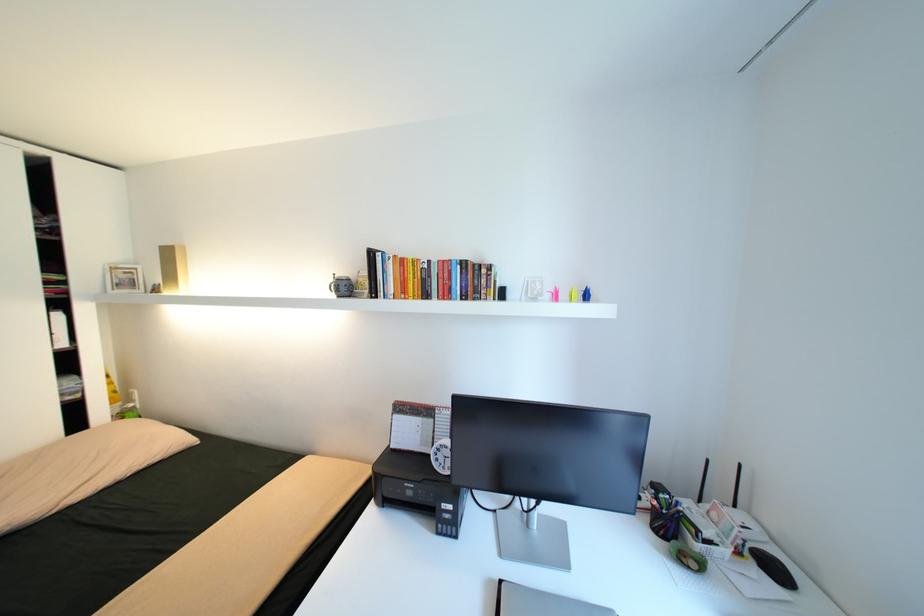
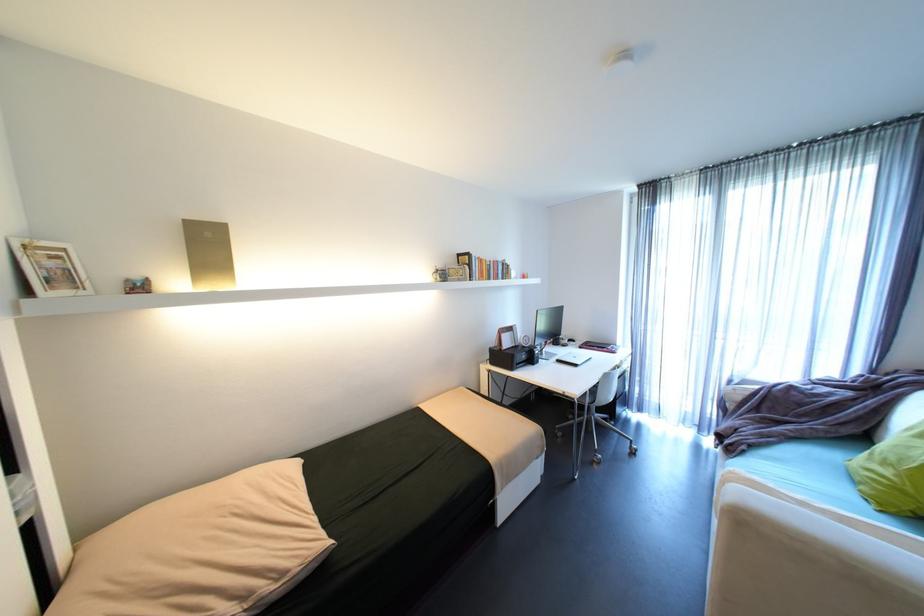
Find the pixel in the second image that matches point (445, 262) in the first image.

(500, 262)